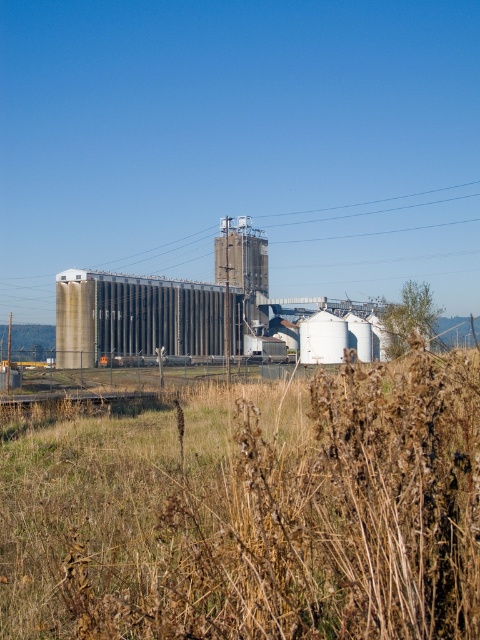
Question: From the image, what is the correct spatial relationship of brown dry grass at center in relation to metallic wire at upper center?

Choices:
 (A) right
 (B) left

Answer: (B)

Question: Can you confirm if brown dry grass at center is wider than metallic wire at upper center?

Choices:
 (A) yes
 (B) no

Answer: (B)

Question: Which of the following is the farthest from the observer?

Choices:
 (A) brown dry grass at center
 (B) metallic wire at upper center

Answer: (B)

Question: Does brown dry grass at center lie in front of metallic wire at upper center?

Choices:
 (A) no
 (B) yes

Answer: (B)